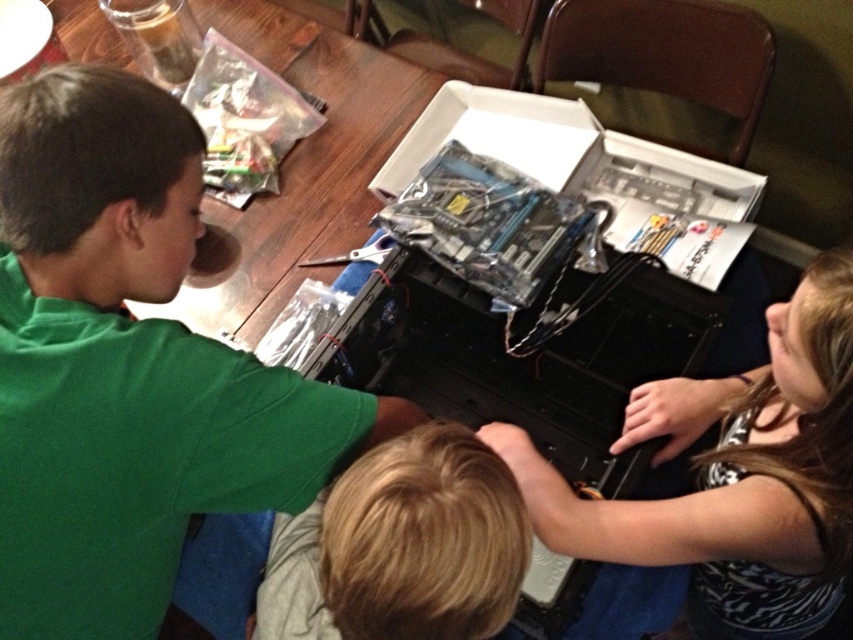
Does point (119, 260) come behind point (463, 456)?

Yes, point (119, 260) is behind point (463, 456).

Between green matte shirt at upper left and blonde hair at center, which one has more height?

Standing taller between the two is green matte shirt at upper left.

Between point (316, 394) and point (418, 536), which one is positioned behind?

Point (316, 394)

I want to click on green matte shirt at upper left, so click(126, 368).